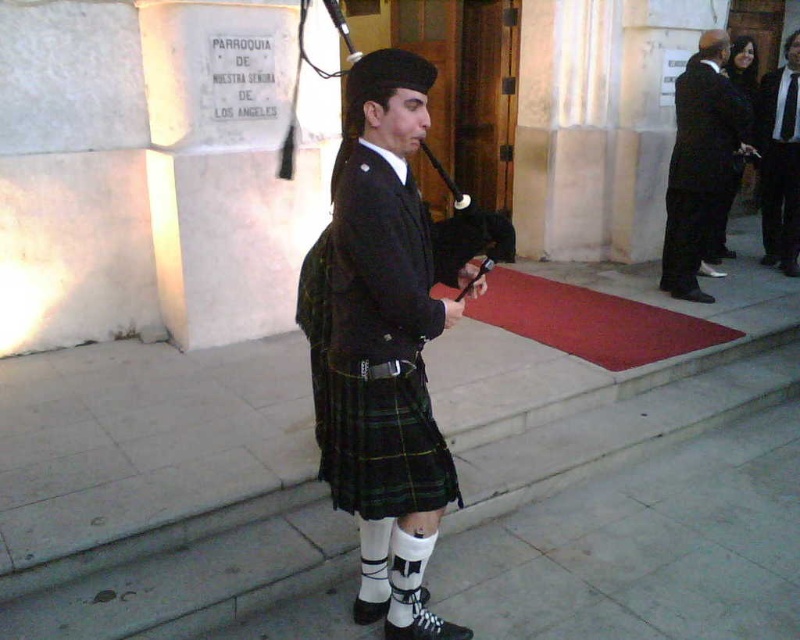
Does black woolen kilt at center have a smaller size compared to black wool suit at right?

Yes.

Who is higher up, black woolen kilt at center or black wool suit at right?

black wool suit at right

Image resolution: width=800 pixels, height=640 pixels. In order to click on black woolen kilt at center in this screenshot , I will do `click(377, 349)`.

Is the position of black woolen kilt at center less distant than that of black leather bagpipe at center?

Yes.

Which of these two, black woolen kilt at center or black leather bagpipe at center, stands shorter?

black leather bagpipe at center is shorter.

Is point (424, 205) behind point (337, 19)?

No, it is not.

Identify the location of black woolen kilt at center. The width and height of the screenshot is (800, 640). (377, 349).

Is point (374, 426) positioned after point (328, 397)?

No, it is not.

Does black woolen kilt at center have a lesser height compared to black plaid kilt at center?

No.

Which is in front, point (450, 492) or point (405, 403)?

Point (405, 403) is in front.

What are the coordinates of `black woolen kilt at center` in the screenshot? It's located at (377, 349).